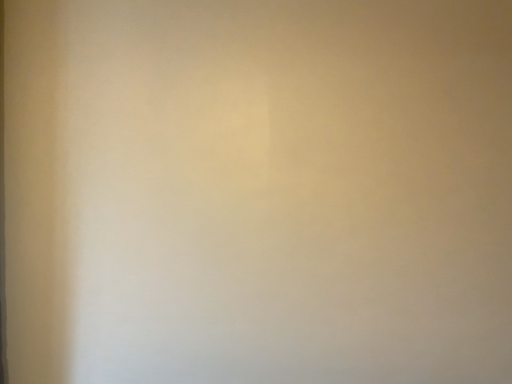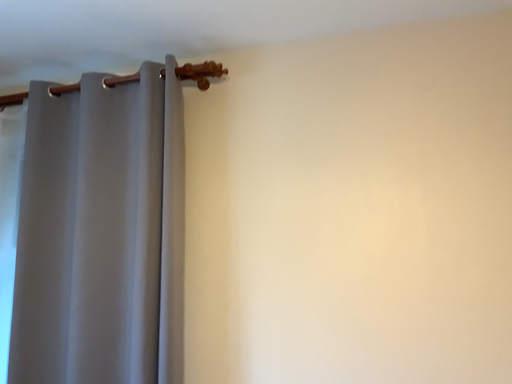
Question: Which way did the camera rotate in the video?

Choices:
 (A) rotated left
 (B) rotated right

Answer: (A)